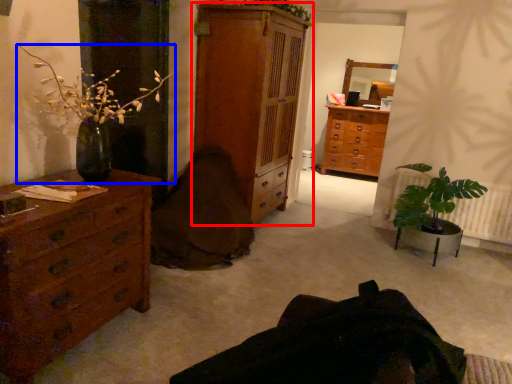
Question: Which object is further to the camera taking this photo, chest of drawers (highlighted by a red box) or houseplant (highlighted by a blue box)?

Choices:
 (A) chest of drawers
 (B) houseplant

Answer: (A)